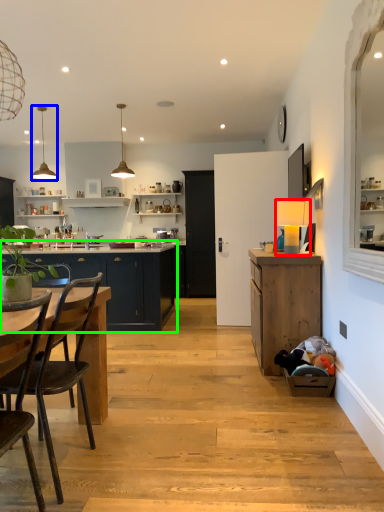
Question: Which is farther away from lamp (highlighted by a red box)? lamp (highlighted by a blue box) or cabinetry (highlighted by a green box)?

Choices:
 (A) lamp
 (B) cabinetry

Answer: (A)